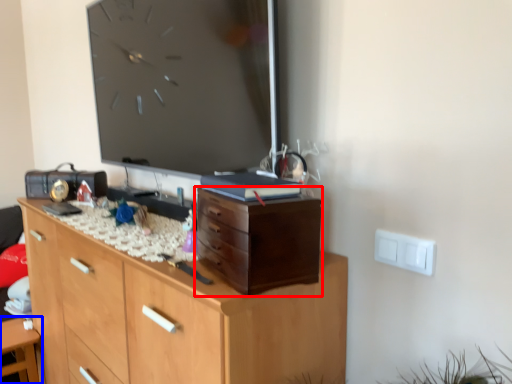
Question: Among these objects, which one is nearest to the camera, chest of drawers (highlighted by a red box) or table (highlighted by a blue box)?

Choices:
 (A) chest of drawers
 (B) table

Answer: (A)